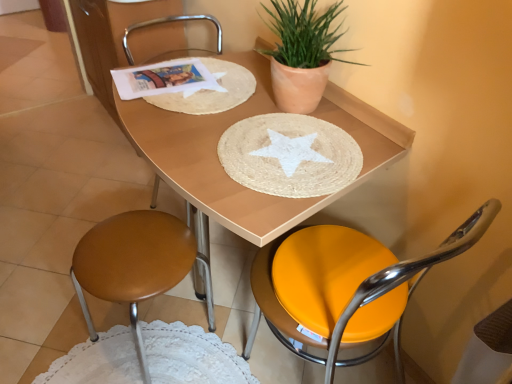
Find the location of a particular element. free space above wooden seat at lower left, the 3th chair in the right-to-left sequence (from a real-world perspective) is located at coordinates (132, 253).